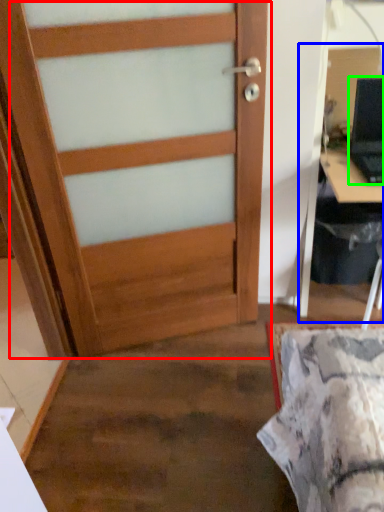
Question: Based on their relative distances, which object is farther from door (highlighted by a red box)? Choose from computer desk (highlighted by a blue box) and laptop (highlighted by a green box).

Choices:
 (A) computer desk
 (B) laptop

Answer: (B)